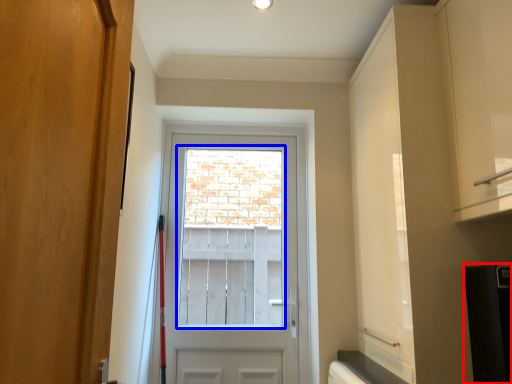
Question: Which point is closer to the camera, appliance (highlighted by a red box) or window screen (highlighted by a blue box)?

Choices:
 (A) appliance
 (B) window screen

Answer: (A)